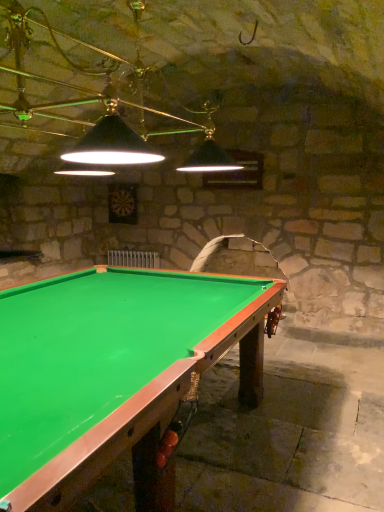
The width and height of the screenshot is (384, 512). What do you see at coordinates (94, 96) in the screenshot? I see `black matte lampshade at upper center` at bounding box center [94, 96].

Locate an element on the screen. Image resolution: width=384 pixels, height=512 pixels. black matte lampshade at upper center is located at coordinates (94, 96).

Describe the element at coordinates (114, 374) in the screenshot. I see `green felt billiard table at center` at that location.

At what (x,y) coordinates should I click in order to perform the action: click on green felt billiard table at center. Please return your answer as a coordinate pair (x, y). This screenshot has height=512, width=384. Looking at the image, I should click on point(114,374).

I want to click on black matte lampshade at upper center, so click(94, 96).

Does green felt billiard table at center appear on the right side of black matte lampshade at upper center?

Correct, you'll find green felt billiard table at center to the right of black matte lampshade at upper center.

From the picture: Is green felt billiard table at center further to camera compared to black matte lampshade at upper center?

No, it is in front of black matte lampshade at upper center.

Is point (73, 298) farther from viewer compared to point (129, 118)?

That is False.

From the image's perspective, would you say green felt billiard table at center is shown under black matte lampshade at upper center?

Yes, from the image's perspective, green felt billiard table at center is beneath black matte lampshade at upper center.

From a real-world perspective, which object rests below the other?

In real-world perspective, green felt billiard table at center is lower.

In terms of width, does green felt billiard table at center look wider or thinner when compared to black matte lampshade at upper center?

Clearly, green felt billiard table at center has more width compared to black matte lampshade at upper center.

Based on the photo, which of these two, green felt billiard table at center or black matte lampshade at upper center, stands shorter?

green felt billiard table at center.

Who is smaller, green felt billiard table at center or black matte lampshade at upper center?

black matte lampshade at upper center is smaller.

Is green felt billiard table at center outside of black matte lampshade at upper center?

Yes, green felt billiard table at center is not within black matte lampshade at upper center.

In the scene shown: Would you say green felt billiard table at center is a long distance from black matte lampshade at upper center?

green felt billiard table at center is far away from black matte lampshade at upper center.

Is green felt billiard table at center oriented towards black matte lampshade at upper center?

No, green felt billiard table at center is not facing towards black matte lampshade at upper center.

Locate an element on the screen. The width and height of the screenshot is (384, 512). lamp behind the green felt billiard table at center is located at coordinates (94, 96).

Based on their positions, is black matte lampshade at upper center located to the left or right of green felt billiard table at center?

Based on their positions, black matte lampshade at upper center is located to the left of green felt billiard table at center.

Is black matte lampshade at upper center positioned behind green felt billiard table at center?

Yes, the depth of black matte lampshade at upper center is greater than that of green felt billiard table at center.

Considering the points (121, 121) and (9, 353), which point is behind, point (121, 121) or point (9, 353)?

The point (9, 353) is farther.

From the image's perspective, does black matte lampshade at upper center appear lower than green felt billiard table at center?

Incorrect, from the image's perspective, black matte lampshade at upper center is higher than green felt billiard table at center.

From a real-world perspective, is black matte lampshade at upper center positioned over green felt billiard table at center based on gravity?

Yes.

Looking at this image, between black matte lampshade at upper center and green felt billiard table at center, which one has larger width?

green felt billiard table at center is wider.

Between black matte lampshade at upper center and green felt billiard table at center, which one has less height?

green felt billiard table at center is shorter.

In terms of size, does black matte lampshade at upper center appear bigger or smaller than green felt billiard table at center?

Clearly, black matte lampshade at upper center is smaller in size than green felt billiard table at center.

Is black matte lampshade at upper center surrounding green felt billiard table at center?

That's incorrect, green felt billiard table at center is not inside black matte lampshade at upper center.

Is black matte lampshade at upper center directly adjacent to green felt billiard table at center?

black matte lampshade at upper center and green felt billiard table at center are not in contact.

Could you tell me if black matte lampshade at upper center is turned towards green felt billiard table at center?

No, black matte lampshade at upper center is not turned towards green felt billiard table at center.

The width and height of the screenshot is (384, 512). I want to click on lamp behind the green felt billiard table at center, so click(94, 96).

Locate an element on the screen. The height and width of the screenshot is (512, 384). lamp that is above the green felt billiard table at center (from the image's perspective) is located at coordinates [94, 96].

The width and height of the screenshot is (384, 512). I want to click on lamp that appears on the left of green felt billiard table at center, so click(94, 96).